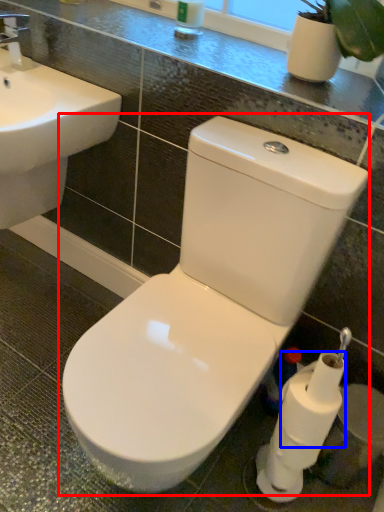
Question: Which point is closer to the camera, toilet (highlighted by a red box) or toilet paper (highlighted by a blue box)?

Choices:
 (A) toilet
 (B) toilet paper

Answer: (A)